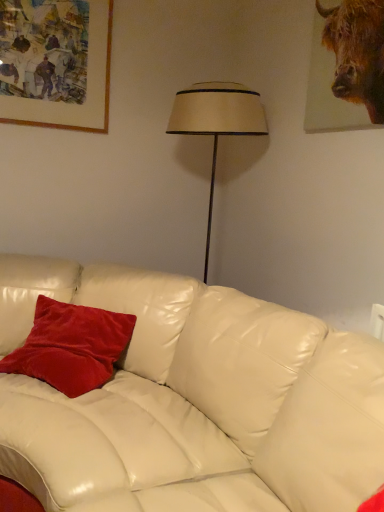
Describe the element at coordinates (71, 346) in the screenshot. Image resolution: width=384 pixels, height=512 pixels. I see `velvet red pillow at center` at that location.

Measure the distance between wooden picture frame at upper left and camera.

The distance of wooden picture frame at upper left from camera is 1.99 meters.

This screenshot has width=384, height=512. In order to click on velvet red pillow at center in this screenshot , I will do `click(71, 346)`.

In the image, is velvet red pillow at center positioned in front of or behind brown textured fur at upper right?

velvet red pillow at center is positioned farther from the viewer than brown textured fur at upper right.

From the image's perspective, is velvet red pillow at center under brown textured fur at upper right?

Correct, velvet red pillow at center appears lower than brown textured fur at upper right in the image.

Is velvet red pillow at center bigger or smaller than brown textured fur at upper right?

velvet red pillow at center is bigger than brown textured fur at upper right.

Considering the relative positions of velvet red pillow at center and brown textured fur at upper right in the image provided, is velvet red pillow at center to the right of brown textured fur at upper right from the viewer's perspective?

In fact, velvet red pillow at center is to the left of brown textured fur at upper right.

In order to click on bull on the right of wooden picture frame at upper left in this screenshot , I will do `click(357, 52)`.

Considering the positions of objects wooden picture frame at upper left and brown textured fur at upper right in the image provided, who is more to the right, wooden picture frame at upper left or brown textured fur at upper right?

brown textured fur at upper right.

Does wooden picture frame at upper left have a greater height compared to brown textured fur at upper right?

Yes, wooden picture frame at upper left is taller than brown textured fur at upper right.

Is point (20, 97) positioned in front of point (355, 56)?

That is False.

From the image's perspective, is brown textured fur at upper right located above velvet red pillow at center?

Correct, brown textured fur at upper right appears higher than velvet red pillow at center in the image.

Considering the sizes of objects brown textured fur at upper right and velvet red pillow at center in the image provided, who is shorter, brown textured fur at upper right or velvet red pillow at center?

With less height is velvet red pillow at center.

Is brown textured fur at upper right not near velvet red pillow at center?

Yes, brown textured fur at upper right and velvet red pillow at center are quite far apart.

Which object is closer to the camera, brown textured fur at upper right or velvet red pillow at center?

brown textured fur at upper right is more forward.

Between velvet red pillow at center and wooden picture frame at upper left, which one has more height?

With more height is wooden picture frame at upper left.

Is velvet red pillow at center positioned with its back to wooden picture frame at upper left?

No.

Which object is closer to the camera taking this photo, velvet red pillow at center or wooden picture frame at upper left?

velvet red pillow at center is in front.

Do you think velvet red pillow at center is within wooden picture frame at upper left, or outside of it?

velvet red pillow at center cannot be found inside wooden picture frame at upper left.

Is brown textured fur at upper right inside the boundaries of wooden picture frame at upper left, or outside?

brown textured fur at upper right cannot be found inside wooden picture frame at upper left.

Is brown textured fur at upper right far away from wooden picture frame at upper left?

That's right, there is a large distance between brown textured fur at upper right and wooden picture frame at upper left.

Considering the relative sizes of brown textured fur at upper right and wooden picture frame at upper left in the image provided, is brown textured fur at upper right smaller than wooden picture frame at upper left?

Yes, brown textured fur at upper right is smaller than wooden picture frame at upper left.

How many degrees apart are the facing directions of wooden picture frame at upper left and velvet red pillow at center?

The angle between the facing direction of wooden picture frame at upper left and the facing direction of velvet red pillow at center is 46.1 degrees.

From a real-world perspective, relative to velvet red pillow at center, is wooden picture frame at upper left vertically above or below?

From a real-world perspective, wooden picture frame at upper left is physically above velvet red pillow at center.

Looking at this image, considering the sizes of wooden picture frame at upper left and velvet red pillow at center in the image, is wooden picture frame at upper left bigger or smaller than velvet red pillow at center?

wooden picture frame at upper left is smaller than velvet red pillow at center.

From the image's perspective, is wooden picture frame at upper left under velvet red pillow at center?

No, from the image's perspective, wooden picture frame at upper left is not beneath velvet red pillow at center.

This screenshot has height=512, width=384. What are the coordinates of `bull that appears in front of the velvet red pillow at center` in the screenshot? It's located at (357, 52).

Identify the location of bull on the right of wooden picture frame at upper left. (357, 52).

Considering their positions, is velvet red pillow at center positioned closer to brown textured fur at upper right than wooden picture frame at upper left?

wooden picture frame at upper left lies closer to brown textured fur at upper right than the other object.

In the scene shown: Estimate the real-world distances between objects in this image. Which object is closer to wooden picture frame at upper left, velvet red pillow at center or brown textured fur at upper right?

velvet red pillow at center lies closer to wooden picture frame at upper left than the other object.

Considering their positions, is brown textured fur at upper right positioned closer to velvet red pillow at center than wooden picture frame at upper left?

wooden picture frame at upper left.

From the image, which object appears to be nearer to wooden picture frame at upper left, brown textured fur at upper right or velvet red pillow at center?

The object closer to wooden picture frame at upper left is velvet red pillow at center.

Which object lies nearer to the anchor point velvet red pillow at center, wooden picture frame at upper left or brown textured fur at upper right?

Based on the image, wooden picture frame at upper left appears to be nearer to velvet red pillow at center.

When comparing their distances from brown textured fur at upper right, does wooden picture frame at upper left or velvet red pillow at center seem further?

Among the two, velvet red pillow at center is located further to brown textured fur at upper right.

In order to click on bull that lies between wooden picture frame at upper left and velvet red pillow at center from top to bottom in this screenshot , I will do `click(357, 52)`.